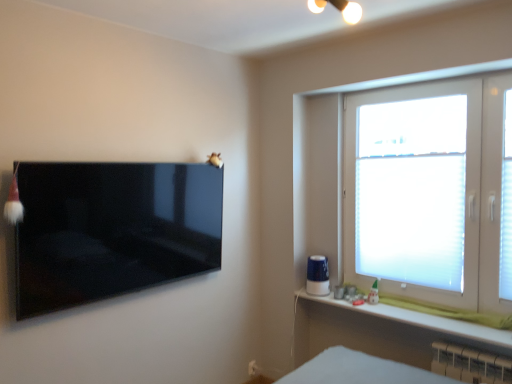
Question: From a real-world perspective, is white translucent blinds at right under glossy black tv at left?

Choices:
 (A) yes
 (B) no

Answer: (A)

Question: Is white translucent blinds at right surrounding glossy black tv at left?

Choices:
 (A) no
 (B) yes

Answer: (A)

Question: Is white translucent blinds at right not inside glossy black tv at left?

Choices:
 (A) no
 (B) yes

Answer: (B)

Question: Considering the relative sizes of white translucent blinds at right and glossy black tv at left in the image provided, is white translucent blinds at right taller than glossy black tv at left?

Choices:
 (A) yes
 (B) no

Answer: (A)

Question: From the image's perspective, is white translucent blinds at right on glossy black tv at left?

Choices:
 (A) no
 (B) yes

Answer: (B)

Question: In the image, is white matte window sill at lower right positioned in front of or behind white plastic electric outlet at lower center?

Choices:
 (A) behind
 (B) front

Answer: (B)

Question: Considering the positions of point (483, 334) and point (250, 374), is point (483, 334) closer or farther from the camera than point (250, 374)?

Choices:
 (A) farther
 (B) closer

Answer: (B)

Question: From the image's perspective, relative to white plastic electric outlet at lower center, is white matte window sill at lower right above or below?

Choices:
 (A) below
 (B) above

Answer: (B)

Question: In terms of size, does white matte window sill at lower right appear bigger or smaller than white plastic electric outlet at lower center?

Choices:
 (A) big
 (B) small

Answer: (A)

Question: From the image's perspective, is white plastic electric outlet at lower center above or below white matte window sill at lower right?

Choices:
 (A) above
 (B) below

Answer: (B)

Question: Is white plastic electric outlet at lower center in front of or behind white matte window sill at lower right in the image?

Choices:
 (A) behind
 (B) front

Answer: (A)

Question: Is white plastic electric outlet at lower center to the left or to the right of white matte window sill at lower right in the image?

Choices:
 (A) left
 (B) right

Answer: (A)

Question: Considering the positions of point (248, 372) and point (388, 314), is point (248, 372) closer or farther from the camera than point (388, 314)?

Choices:
 (A) closer
 (B) farther

Answer: (B)

Question: Considering the positions of white plastic electric outlet at lower center and white plastic radiator at lower right in the image, is white plastic electric outlet at lower center taller or shorter than white plastic radiator at lower right?

Choices:
 (A) short
 (B) tall

Answer: (A)

Question: Relative to white plastic radiator at lower right, is white plastic electric outlet at lower center in front or behind?

Choices:
 (A) front
 (B) behind

Answer: (B)